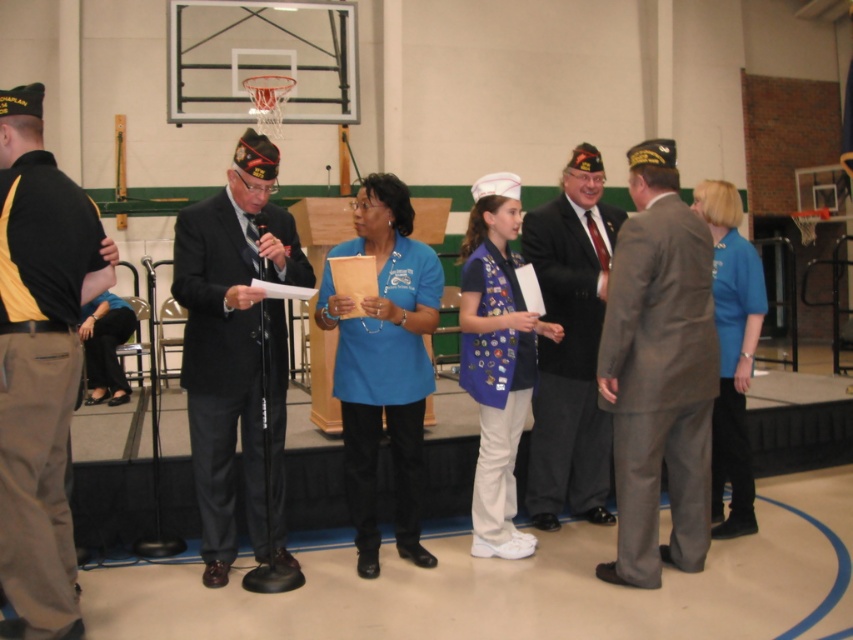
You are organizing a photo shoot and need to position two models wearing the matte black suit at center and blue fabric vest at center. Based on the scene description, which model should you place closer to the blue circular marking on the floor to ensure they are both visible in the frame?

The matte black suit at center might be wider than blue fabric vest at center, so placing the model in the matte black suit at center closer to the blue circular marking on the floor would ensure both are visible as the wider suit may require more space in the frame.

You are standing at the origin point of the coordinate system in the gymnasium. The gymnasium uses a coordinate system where the bottom left corner is the origin. You want to move to the black uniform at left. Which direction should you move?

Since the black uniform at left is located at coordinate point 0.566 on the x axis and 0.047 on the y axis, you should move to the right and slightly forward to reach it.